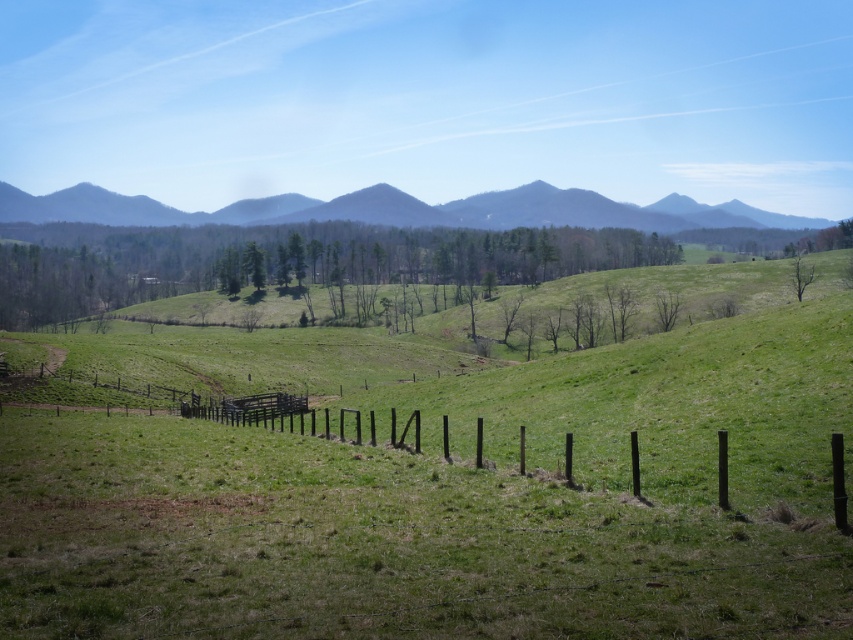
You are a hiker standing in the field and want to take a photo of the green leafy trees at center and the green leafy tree at upper right. Which one would appear closer to you in the photo?

The green leafy trees at center would appear closer to you in the photo because the green leafy tree at upper right is positioned behind them.

You are a bird looking for a nesting spot. You see two options in the image, the green leafy trees at center and the green leafy tree at upper right. Which one would provide a taller nesting spot?

The green leafy trees at center is much taller than the green leafy tree at upper right, so it would provide a taller nesting spot.

You are standing at the point labeled as point [461,490] in the image. What object are you standing on?

You are standing on the brown wooden fence at center as indicated by the point [461,490].